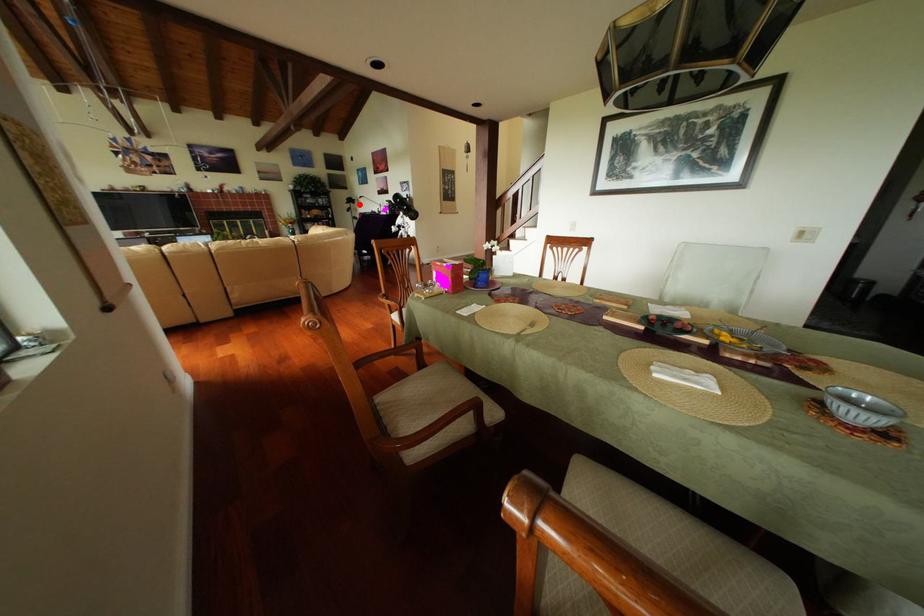
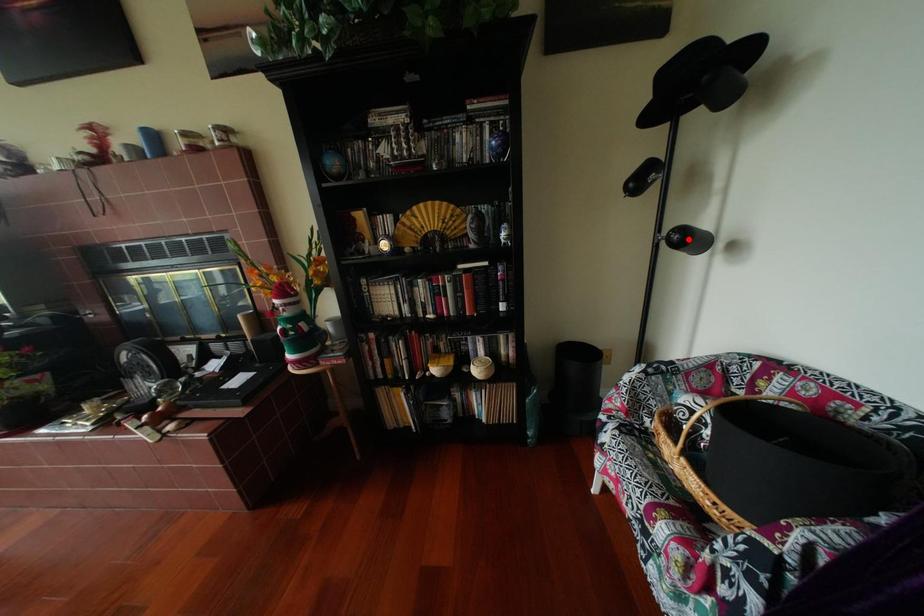
I am providing you with two images of the same scene from different viewpoints. A red point is marked on the first image and another point is marked on the second image. Does the point marked in image1 correspond to the same location as the one in image2?

No